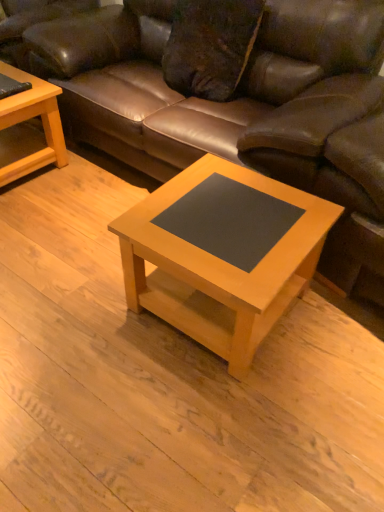
Question: Is light wood/finely finished coffee table at left, which appears as the second coffee table when ordered from the bottom, not within brown leather couch at center?

Choices:
 (A) yes
 (B) no

Answer: (A)

Question: Is light wood/finely finished coffee table at left, which is counted as the 2th coffee table, starting from the front, facing towards brown leather couch at center?

Choices:
 (A) yes
 (B) no

Answer: (B)

Question: Does light wood/finely finished coffee table at left, which appears as the second coffee table when ordered from the bottom, have a greater width compared to brown leather couch at center?

Choices:
 (A) yes
 (B) no

Answer: (B)

Question: Is light wood/finely finished coffee table at left, the 2th coffee table viewed from the right, closer to the viewer compared to brown leather couch at center?

Choices:
 (A) yes
 (B) no

Answer: (B)

Question: From the image's perspective, does light wood/finely finished coffee table at left, which is the first coffee table in left-to-right order, appear lower than brown leather couch at center?

Choices:
 (A) yes
 (B) no

Answer: (A)

Question: In terms of height, does light wood/black laminate coffee table at center, which is the 1th coffee table from bottom to top, look taller or shorter compared to light wood/finely finished coffee table at left, which appears as the second coffee table when ordered from the bottom?

Choices:
 (A) short
 (B) tall

Answer: (B)

Question: From the image's perspective, is light wood/black laminate coffee table at center, placed as the first coffee table when sorted from right to left, located above or below light wood/finely finished coffee table at left, the 2th coffee table viewed from the right?

Choices:
 (A) above
 (B) below

Answer: (B)

Question: In the image, is light wood/black laminate coffee table at center, which is the 1th coffee table from bottom to top, positioned in front of or behind light wood/finely finished coffee table at left, the first coffee table viewed from the top?

Choices:
 (A) front
 (B) behind

Answer: (A)

Question: Does point (205, 175) appear closer or farther from the camera than point (4, 123)?

Choices:
 (A) farther
 (B) closer

Answer: (B)

Question: From a real-world perspective, is light wood/finely finished coffee table at left, the 1th coffee table in the back-to-front sequence, positioned above or below light wood/black laminate coffee table at center, arranged as the 2th coffee table when viewed from the top?

Choices:
 (A) above
 (B) below

Answer: (B)

Question: Does point (6, 144) appear closer or farther from the camera than point (251, 291)?

Choices:
 (A) farther
 (B) closer

Answer: (A)

Question: Is light wood/finely finished coffee table at left, which appears as the second coffee table when ordered from the bottom, wider or thinner than light wood/black laminate coffee table at center, which is the 1th coffee table from bottom to top?

Choices:
 (A) wide
 (B) thin

Answer: (B)

Question: Is light wood/finely finished coffee table at left, which is the first coffee table in left-to-right order, taller or shorter than light wood/black laminate coffee table at center, which is the 1th coffee table from bottom to top?

Choices:
 (A) tall
 (B) short

Answer: (B)

Question: From a real-world perspective, relative to brown leather couch at center, is light wood/finely finished coffee table at left, which is counted as the 2th coffee table, starting from the front, vertically above or below?

Choices:
 (A) above
 (B) below

Answer: (B)

Question: Is light wood/finely finished coffee table at left, which appears as the second coffee table when ordered from the bottom, in front of or behind brown leather couch at center in the image?

Choices:
 (A) behind
 (B) front

Answer: (A)